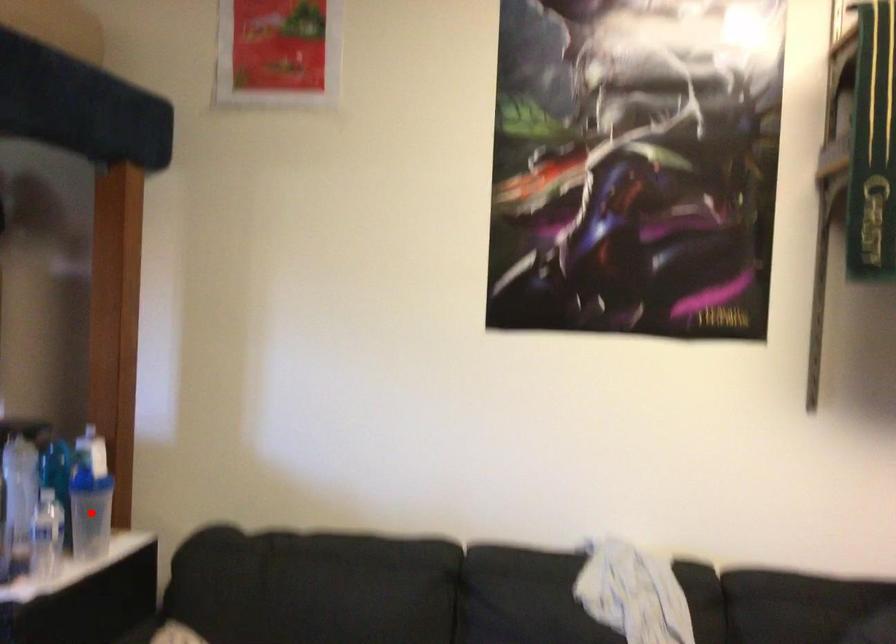
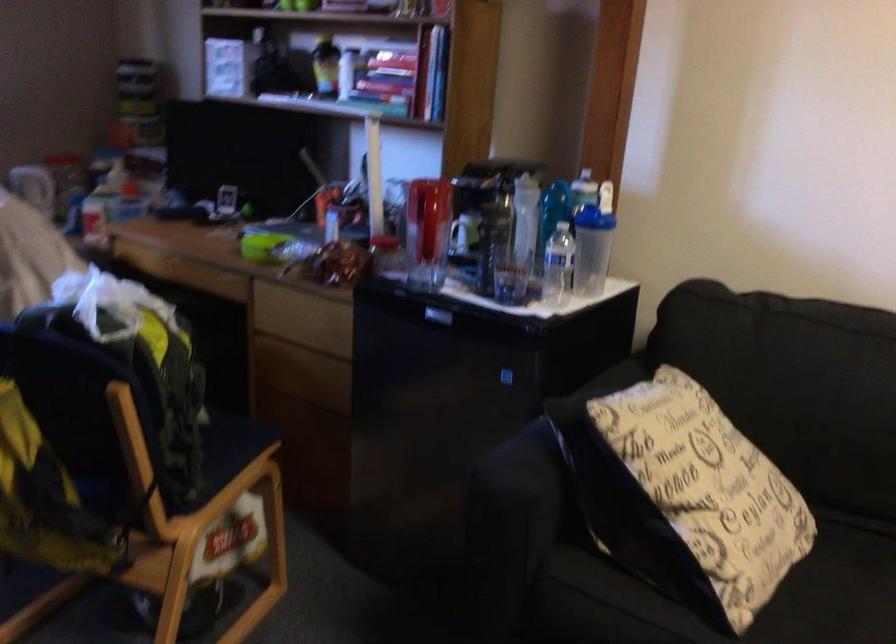
Locate, in the second image, the point that corresponds to the highlighted location in the first image.

(591, 250)